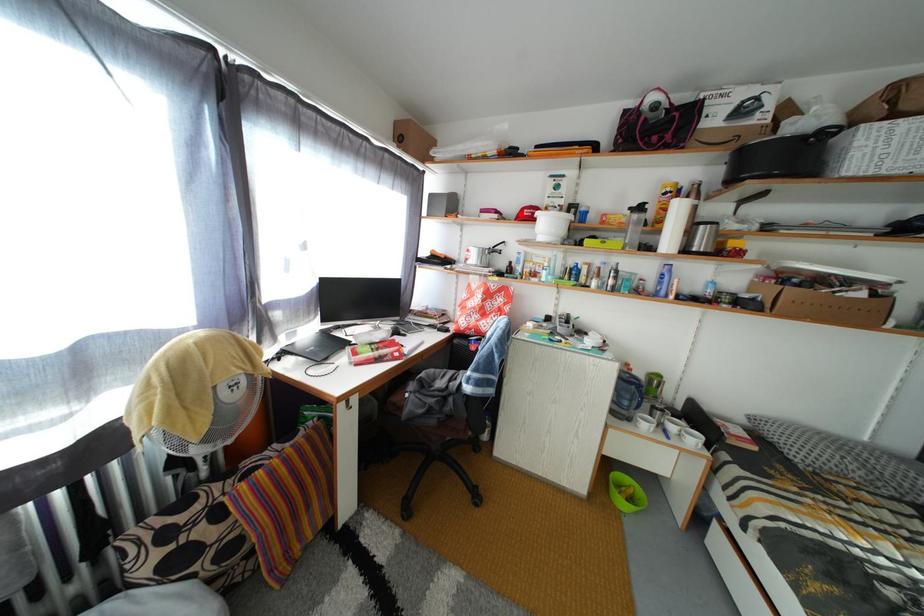
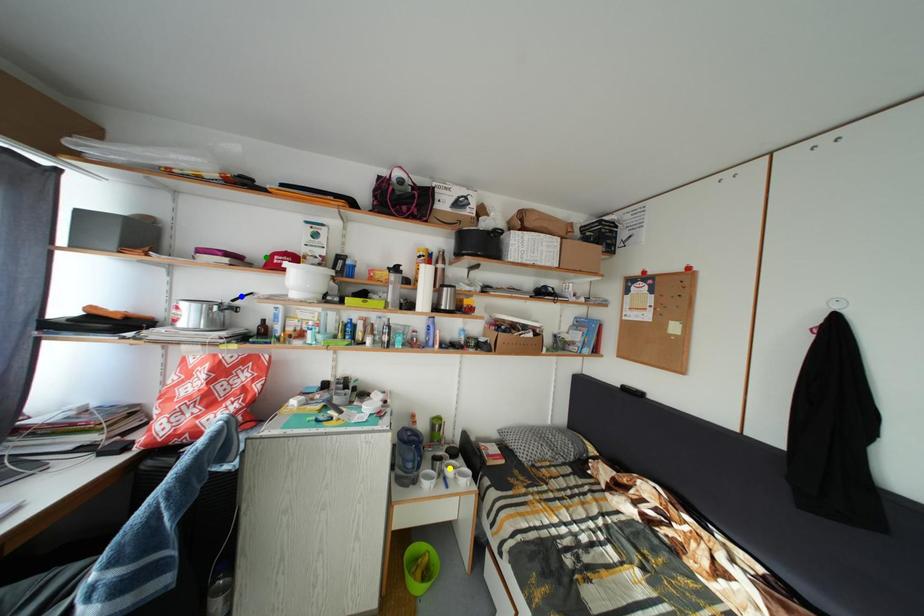
Question: I am providing you with two images of the same scene from different viewpoints. A red point is marked on the first image. You are given multiple points on the second image. Which point in image 2 is actually the same real-world point as the red point in image 1?

Choices:
 (A) green point
 (B) blue point
 (C) yellow point

Answer: (A)